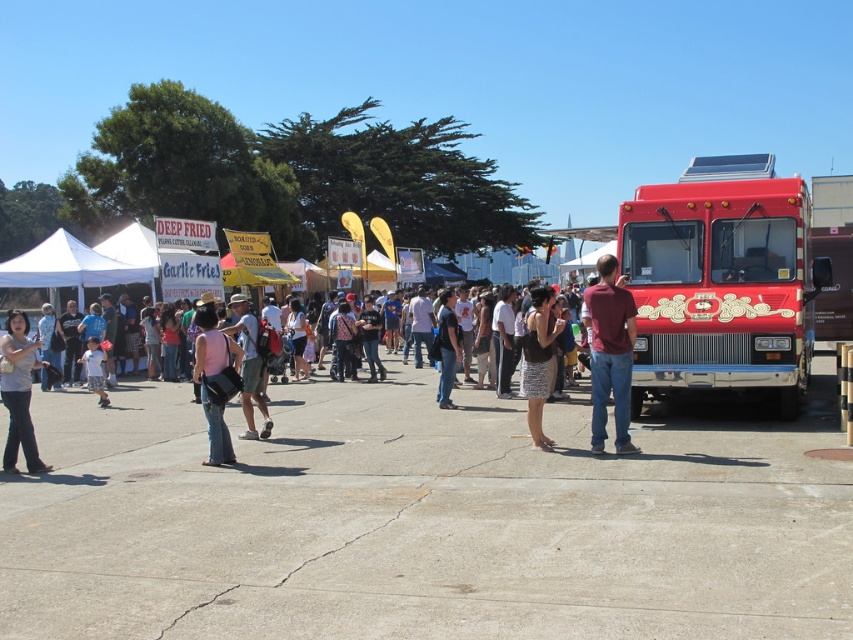
You are a photographer at the event and want to capture both the black textured dress at center and the khaki shorts at center in a single photo. Which clothing item should you focus on first to ensure both are in frame?

The black textured dress at center is located below the khaki shorts at center, so you should focus on the khaki shorts at center first to ensure both are in frame.

You are at the food festival and see a person wearing a maroon shirt at center and another wearing denim pants at left. Which clothing item is positioned more towards the right side of the scene?

The maroon shirt at center is positioned more towards the right side of the scene compared to the denim pants at left.